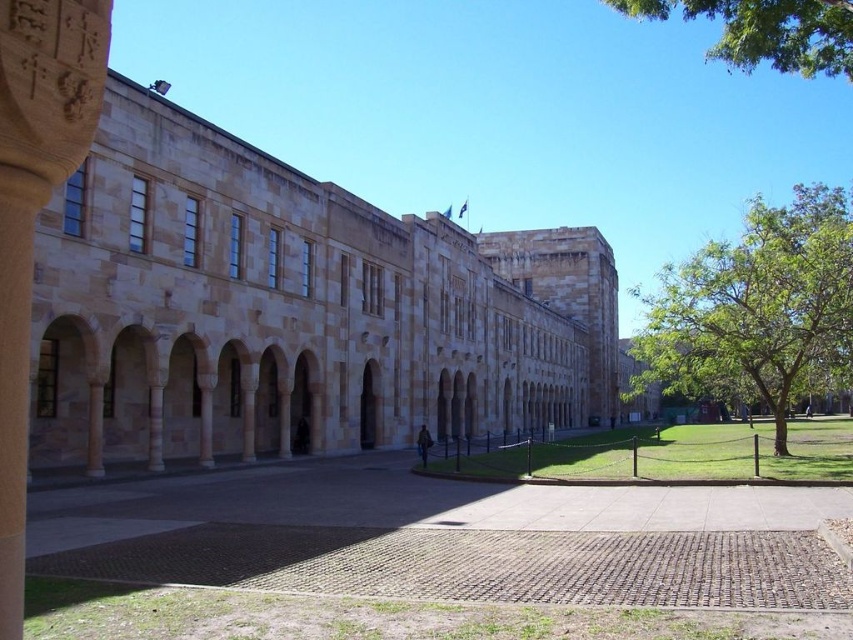
You are standing in front of the historic building and want to walk from the carved stone pillar at center to the green leafy tree at right. Which direction should you head?

You should head to the right because the green leafy tree at right is located to the right of the carved stone pillar at center.

You are a landscape architect designing a new pathway between the green leafy tree at right and the green leafy tree at upper right. Which tree should you consider for a wider path due to its size?

The green leafy tree at right is wider than the green leafy tree at upper right, so the wider path should be designed around the green leafy tree at right.